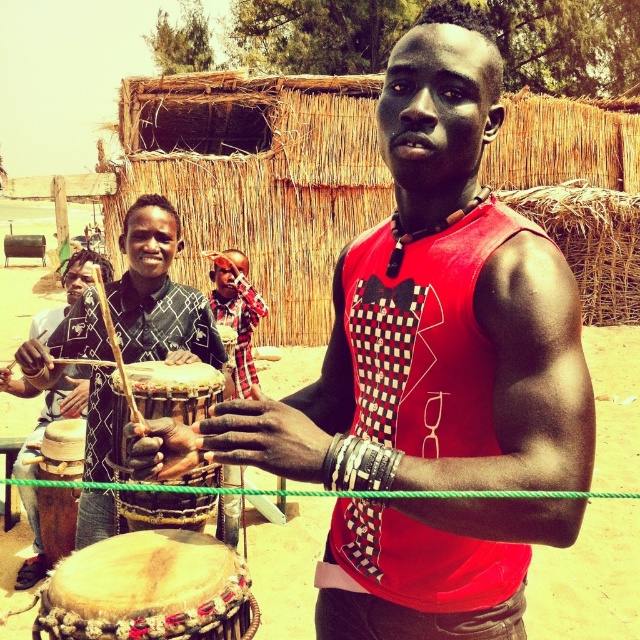
Question: Can you confirm if matte black drum at left is wider than leather-like drum at lower left?

Choices:
 (A) no
 (B) yes

Answer: (B)

Question: Can you confirm if brown sandy dirt at center is positioned to the right of brown wooden drum at lower left?

Choices:
 (A) no
 (B) yes

Answer: (B)

Question: Which point is closer to the camera?

Choices:
 (A) leather-like drum at lower left
 (B) brown wooden drum at lower left

Answer: (A)

Question: Which object is positioned closest to the leather-like drum at lower left?

Choices:
 (A) brown textured drum at center
 (B) brown wooden drum at lower left

Answer: (A)

Question: Is brown sandy dirt at center below brown textured drum at center?

Choices:
 (A) no
 (B) yes

Answer: (B)

Question: Which of the following is the closest to the observer?

Choices:
 (A) brown textured drum at center
 (B) brown wooden drum at lower left

Answer: (A)